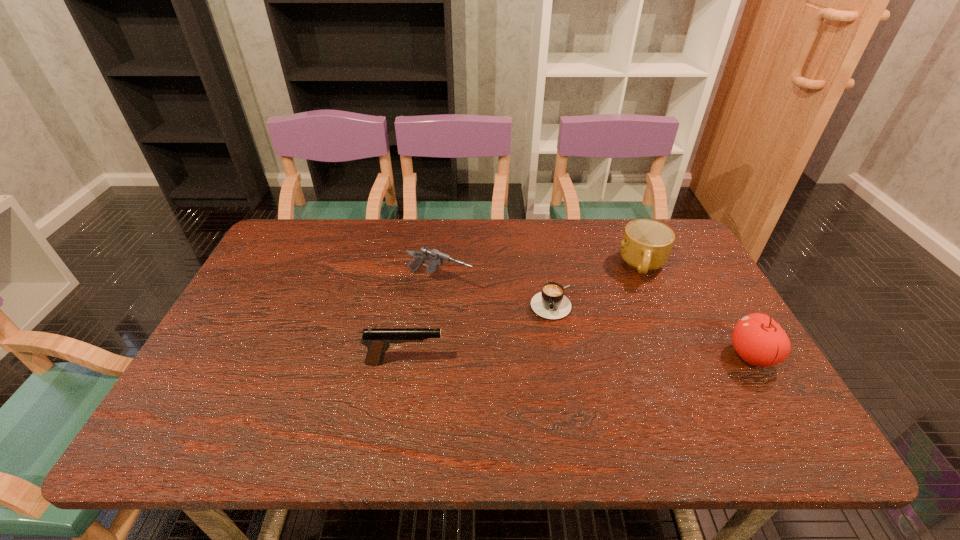
At what (x,y) coordinates should I click in order to perform the action: click on free space on the desktop that is between the pistol and the rightmost object and is positioned on the side with the handle of the mug. Please return your answer as a coordinate pair (x, y). Looking at the image, I should click on (602, 359).

You are a GUI agent. You are given a task and a screenshot of the screen. Output one action in this format:
    pyautogui.click(x=<x>, y=<y>)
    Task: Click on the vacant space on the desktop that is between the pistol and the apple and is positioned with the handle on the side of the third object from left to right
    The image size is (960, 540).
    Given the screenshot: What is the action you would take?
    (x=548, y=360)

Identify the location of free spot on the desktop that is between the pistol and the apple and is positioned at the barrel of the gun. (623, 358).